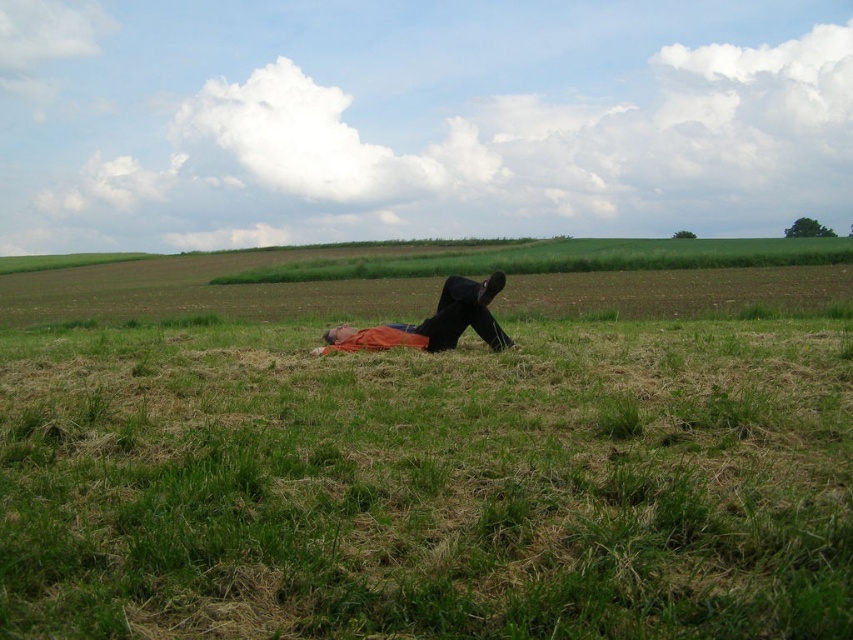
Question: Is green grassy at center above orange cotton shirt at center?

Choices:
 (A) no
 (B) yes

Answer: (A)

Question: Which of the following is the farthest from the observer?

Choices:
 (A) (379, 620)
 (B) (403, 330)

Answer: (B)

Question: Can you confirm if green grassy at center is positioned above orange cotton shirt at center?

Choices:
 (A) no
 (B) yes

Answer: (A)

Question: Which of the following is the farthest from the observer?

Choices:
 (A) orange fabric blanket at center
 (B) orange cotton shirt at center

Answer: (A)

Question: Does green grassy at center have a greater width compared to orange fabric blanket at center?

Choices:
 (A) yes
 (B) no

Answer: (A)

Question: Which of the following is the closest to the observer?

Choices:
 (A) orange fabric blanket at center
 (B) orange cotton shirt at center

Answer: (B)